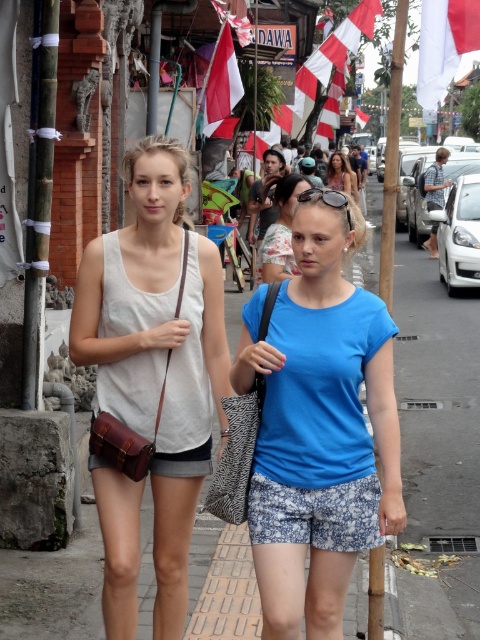
Question: Which point is farther to the camera?

Choices:
 (A) white and red fabric flag at upper center
 (B) gray concrete pavement at center
 (C) matte blue shirt at center

Answer: (C)

Question: Can you confirm if gray concrete pavement at center is wider than matte blue shirt at center?

Choices:
 (A) no
 (B) yes

Answer: (B)

Question: Does white and red striped flag at upper center appear under red fabric flag at upper center?

Choices:
 (A) no
 (B) yes

Answer: (B)

Question: Is blue cotton t-shirt at center smaller than red fabric flag at upper center?

Choices:
 (A) no
 (B) yes

Answer: (B)

Question: Which point is farther to the camera?

Choices:
 (A) gray concrete pavement at center
 (B) white and red fabric flag at upper center
 (C) white and red striped flag at upper center

Answer: (B)

Question: Which point is closer to the camera?

Choices:
 (A) blue cotton t-shirt at center
 (B) white and red striped flag at upper center
 (C) white fabric flag at upper center
 (D) red fabric flag at upper center

Answer: (A)